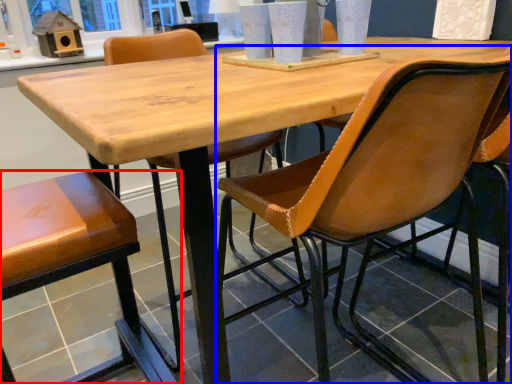
Question: Among these objects, which one is farthest to the camera, chair (highlighted by a red box) or chair (highlighted by a blue box)?

Choices:
 (A) chair
 (B) chair

Answer: (A)